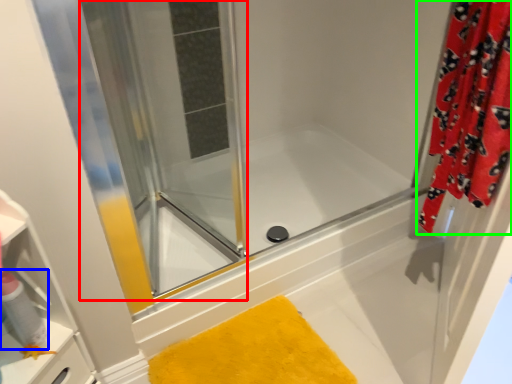
Question: Based on their relative distances, which object is farther from screen door (highlighted by a red box)? Choose from cleaning product (highlighted by a blue box) and curtain (highlighted by a green box).

Choices:
 (A) cleaning product
 (B) curtain

Answer: (A)